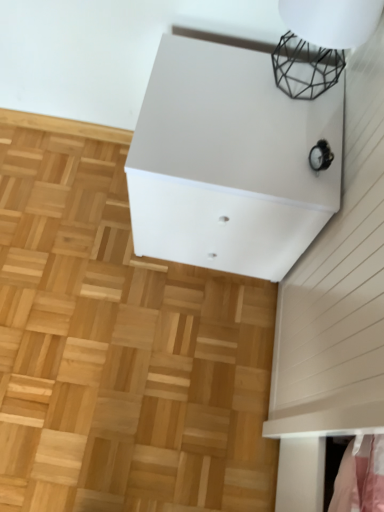
The image size is (384, 512). Find the location of `empty space that is ontop of white matte cabinet at upper center (from a real-world perspective)`. empty space that is ontop of white matte cabinet at upper center (from a real-world perspective) is located at coordinates (243, 115).